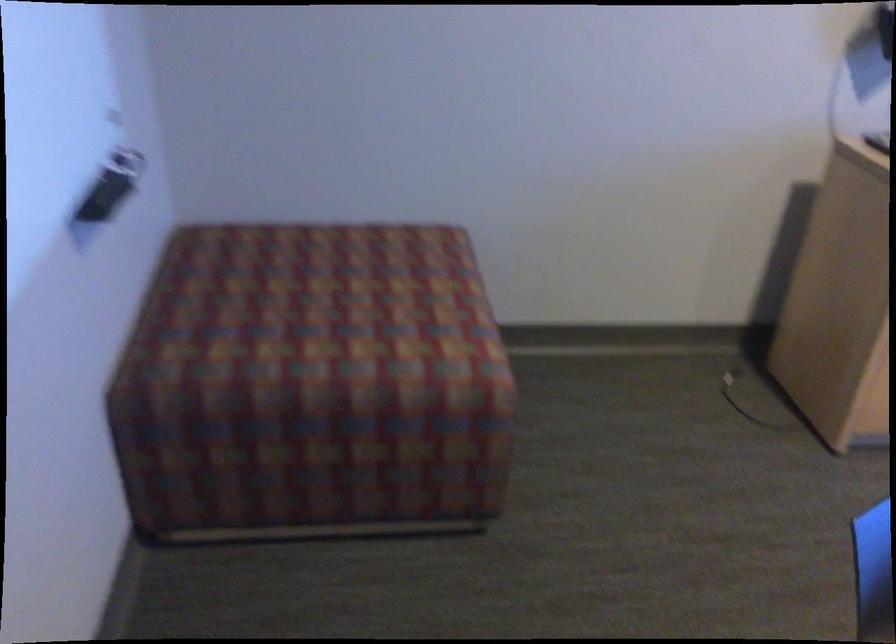
Where would you sit the ottoman sitting surface? Please return your answer as a coordinate pair (x, y).

(332, 301)